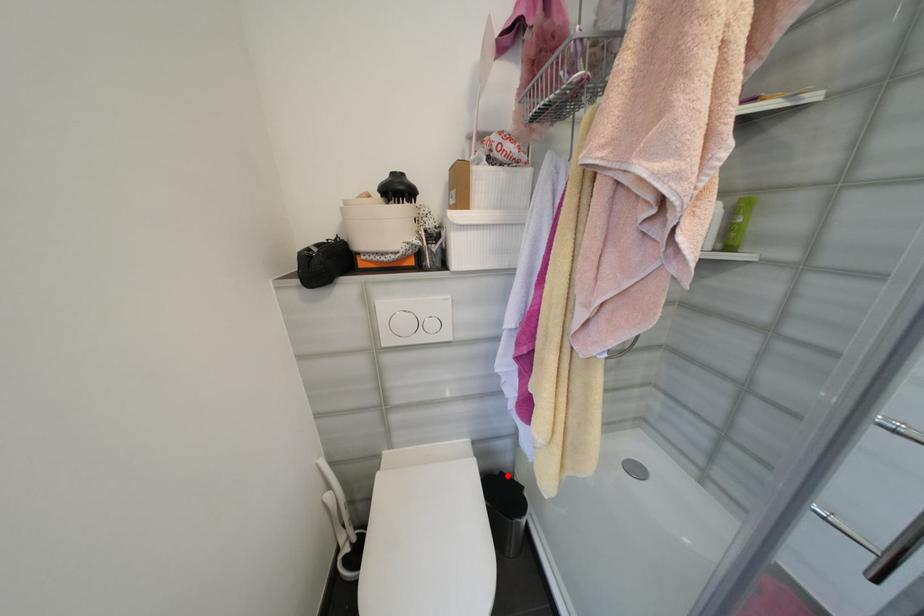
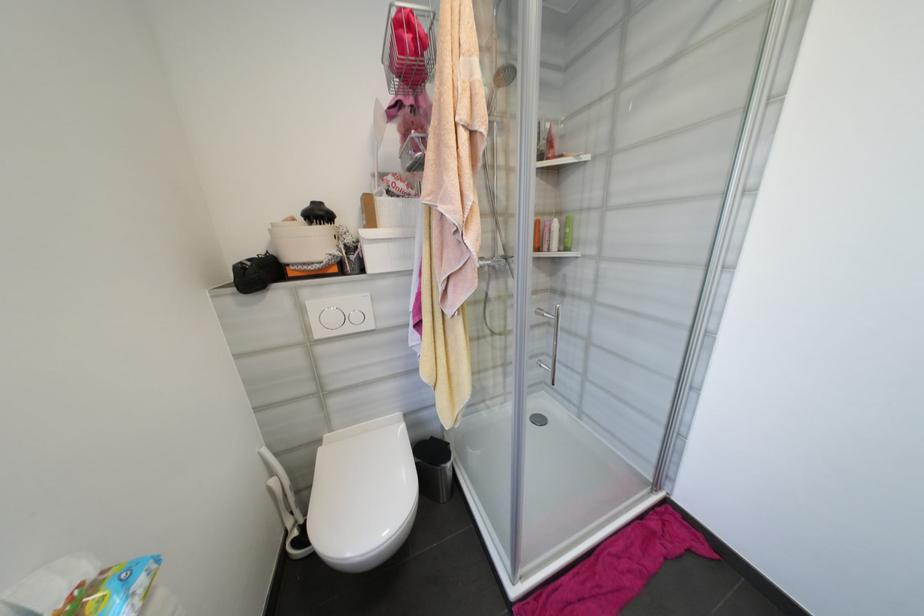
The point at the highlighted location is marked in the first image. Where is the corresponding point in the second image?

(438, 440)